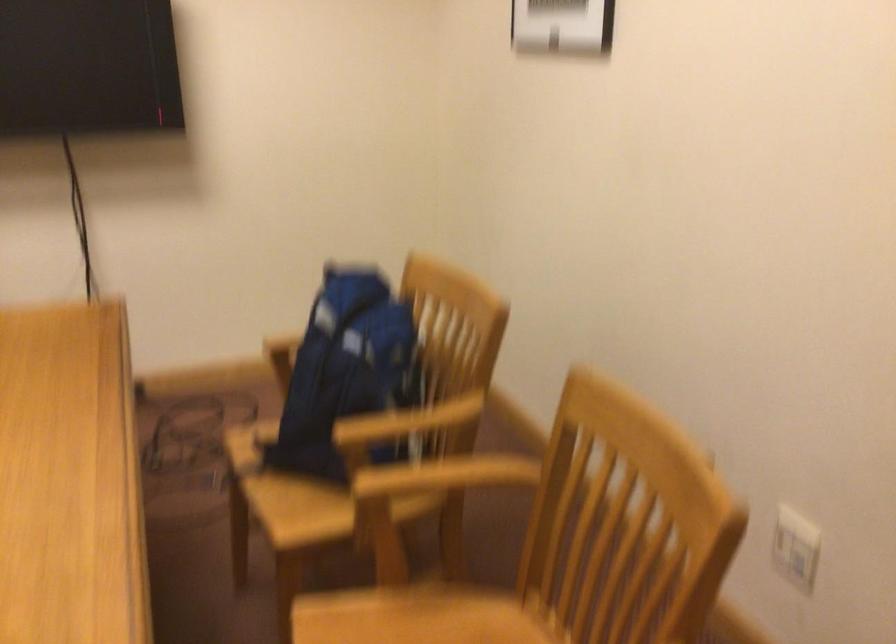
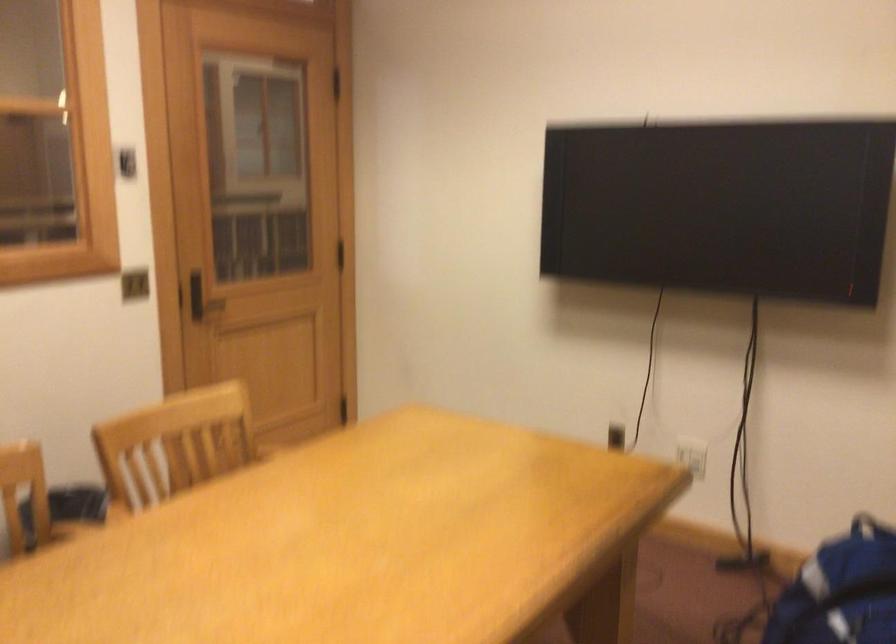
Question: The camera is either moving clockwise (left) or counter-clockwise (right) around the object. The first image is from the beginning of the video and the second image is from the end. Is the camera moving left or right when shooting the video?

Choices:
 (A) Left
 (B) Right

Answer: (B)